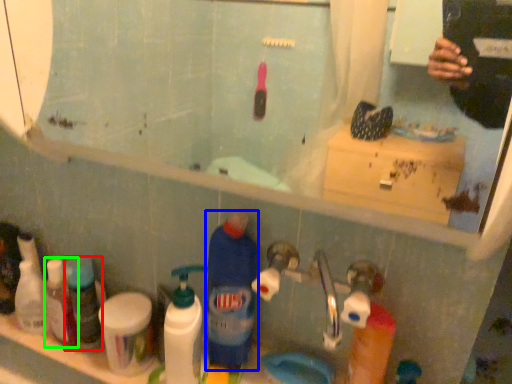
Question: Based on their relative distances, which object is nearer to toiletry (highlighted by a red box)? Choose from cleaning product (highlighted by a blue box) and toiletry (highlighted by a green box).

Choices:
 (A) cleaning product
 (B) toiletry

Answer: (B)